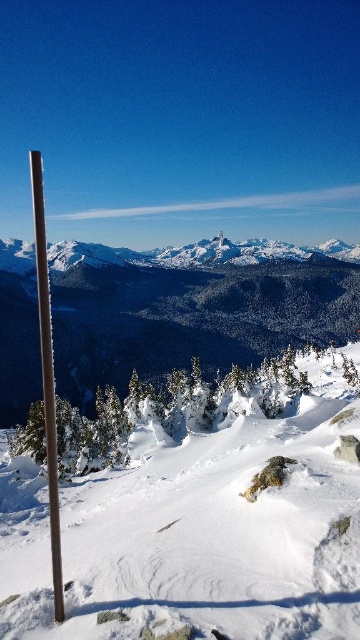
Question: Which point is farther to the camera?

Choices:
 (A) (43, 310)
 (B) (246, 616)

Answer: (B)

Question: Which object is positioned closest to the smooth brown pole at left?

Choices:
 (A) white fluffy snow at center
 (B) snowy mountain at center

Answer: (A)

Question: Which object is closer to the camera taking this photo?

Choices:
 (A) white fluffy snow at center
 (B) snowy mountain at center
 (C) smooth brown pole at left

Answer: (A)

Question: Can you confirm if white fluffy snow at center is wider than smooth brown pole at left?

Choices:
 (A) no
 (B) yes

Answer: (A)

Question: Does white fluffy snow at center have a larger size compared to snowy mountain at center?

Choices:
 (A) no
 (B) yes

Answer: (A)

Question: Can you confirm if white fluffy snow at center is bigger than smooth brown pole at left?

Choices:
 (A) yes
 (B) no

Answer: (B)